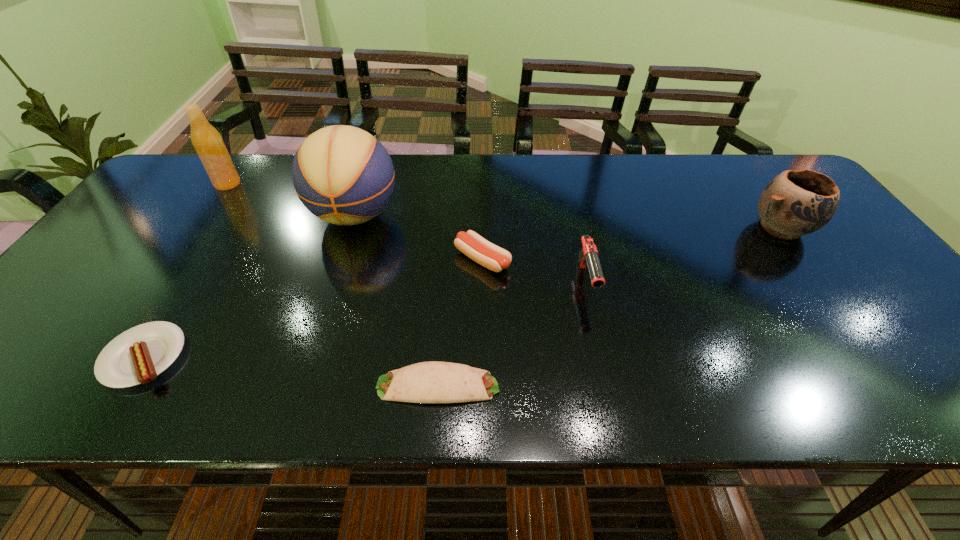
This screenshot has width=960, height=540. I want to click on vacant space in between the fourth shortest object and the rightmost object, so click(x=684, y=255).

At what (x,y) coordinates should I click in order to perform the action: click on vacant point located between the burrito and the beer bottle. Please return your answer as a coordinate pair (x, y). Image resolution: width=960 pixels, height=540 pixels. Looking at the image, I should click on (333, 285).

The width and height of the screenshot is (960, 540). I want to click on free spot between the pottery and the farther sausage, so click(632, 244).

Find the location of a particular element. vacant point located between the farther sausage and the shortest object is located at coordinates (460, 322).

Identify the location of free spot between the right sausage and the rightmost object. This screenshot has width=960, height=540. (632, 244).

This screenshot has width=960, height=540. Find the location of `unoccupied area between the fourth shortest object and the shorter sausage`. unoccupied area between the fourth shortest object and the shorter sausage is located at coordinates (365, 320).

Image resolution: width=960 pixels, height=540 pixels. Identify the location of free spot between the shortest object and the gun. (512, 334).

At what (x,y) coordinates should I click in order to perform the action: click on vacant space that is in between the beer bottle and the fifth object from right to left. Please return your answer as a coordinate pair (x, y). Looking at the image, I should click on tap(291, 199).

Identify the location of object that is the fourth nearest to the third shortest object. Image resolution: width=960 pixels, height=540 pixels. (137, 356).

Identify which object is the second closest to the third shortest object. Please provide its 2D coordinates. Your answer should be formatted as a tuple, i.e. [(x, y)], where the tuple contains the x and y coordinates of a point satisfying the conditions above.

[(588, 255)]